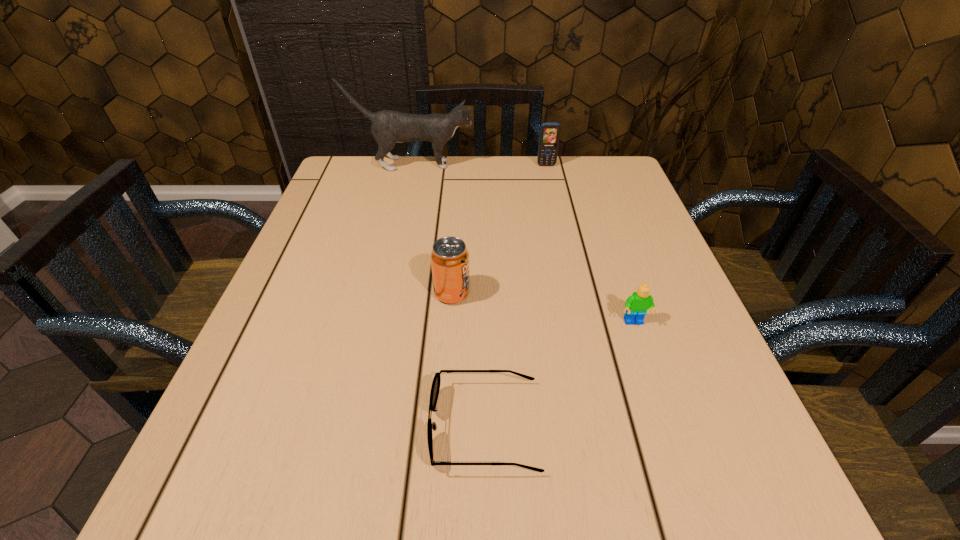
Where is `unoccupied position between the second nearest object and the third nearest object`? This screenshot has width=960, height=540. unoccupied position between the second nearest object and the third nearest object is located at coordinates (543, 308).

Identify the location of empty space between the cellular telephone and the soda can. This screenshot has height=540, width=960. (499, 230).

This screenshot has height=540, width=960. I want to click on empty location between the soda can and the tallest object, so click(432, 229).

You are a GUI agent. You are given a task and a screenshot of the screen. Output one action in this format:
    pyautogui.click(x=<x>, y=<y>)
    Task: Click on the free space between the Lego and the nearest object
    
    Given the screenshot: What is the action you would take?
    pyautogui.click(x=560, y=374)

At what (x,y) coordinates should I click in order to perform the action: click on free space between the tallest object and the third farthest object. Please return your answer as a coordinate pair (x, y). This screenshot has width=960, height=540. Looking at the image, I should click on (432, 229).

Locate an element on the screen. This screenshot has height=540, width=960. free area in between the Lego and the cat is located at coordinates click(523, 244).

In order to click on unoccupied position between the cellular telephone and the shortest object in this screenshot , I will do `click(516, 296)`.

Select which object appears as the closest to the fourth tallest object. Please provide its 2D coordinates. Your answer should be formatted as a tuple, i.e. [(x, y)], where the tuple contains the x and y coordinates of a point satisfying the conditions above.

[(435, 387)]

Locate an element on the screen. The image size is (960, 540). the third closest object to the tallest object is located at coordinates 637,304.

Image resolution: width=960 pixels, height=540 pixels. Find the location of `free space that satisfies the following two spatial constraints: 1. on the back side of the third nearest object; 2. at the face of the cat`. free space that satisfies the following two spatial constraints: 1. on the back side of the third nearest object; 2. at the face of the cat is located at coordinates (461, 164).